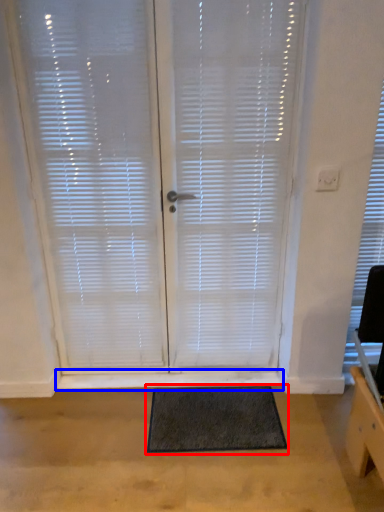
Question: Which object appears closest to the camera in this image, doormat (highlighted by a red box) or window sill (highlighted by a blue box)?

Choices:
 (A) doormat
 (B) window sill

Answer: (A)